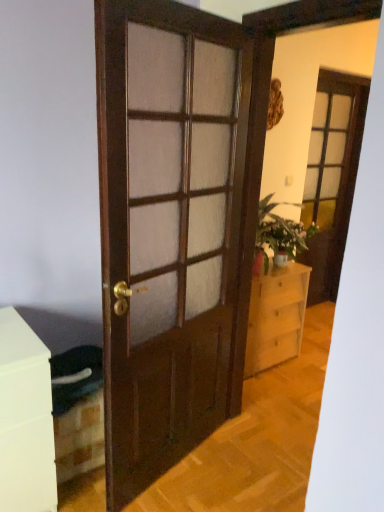
Question: From a real-world perspective, is light wood chest of drawers at center below matte pink vase at center-right?

Choices:
 (A) no
 (B) yes

Answer: (B)

Question: Would you consider light wood chest of drawers at center to be distant from matte pink vase at center-right?

Choices:
 (A) no
 (B) yes

Answer: (A)

Question: From the image's perspective, is light wood chest of drawers at center beneath matte pink vase at center-right?

Choices:
 (A) no
 (B) yes

Answer: (B)

Question: Is light wood chest of drawers at center not within matte pink vase at center-right?

Choices:
 (A) yes
 (B) no

Answer: (A)

Question: Does light wood chest of drawers at center have a smaller size compared to matte pink vase at center-right?

Choices:
 (A) yes
 (B) no

Answer: (B)

Question: In the image, is matte glass screen door at upper right positioned in front of or behind light wood chest of drawers at center?

Choices:
 (A) behind
 (B) front

Answer: (A)

Question: From their relative heights in the image, would you say matte glass screen door at upper right is taller or shorter than light wood chest of drawers at center?

Choices:
 (A) tall
 (B) short

Answer: (A)

Question: Looking at their shapes, would you say matte glass screen door at upper right is wider or thinner than light wood chest of drawers at center?

Choices:
 (A) wide
 (B) thin

Answer: (B)

Question: Considering the positions of point (311, 141) and point (259, 313), is point (311, 141) closer or farther from the camera than point (259, 313)?

Choices:
 (A) farther
 (B) closer

Answer: (A)

Question: Considering their positions, is wooden door at center located in front of or behind light wood chest of drawers at center?

Choices:
 (A) behind
 (B) front

Answer: (B)

Question: Is wooden door at center inside the boundaries of light wood chest of drawers at center, or outside?

Choices:
 (A) outside
 (B) inside

Answer: (A)

Question: From a real-world perspective, is wooden door at center above or below light wood chest of drawers at center?

Choices:
 (A) below
 (B) above

Answer: (B)

Question: Looking at the image, does wooden door at center seem bigger or smaller compared to light wood chest of drawers at center?

Choices:
 (A) big
 (B) small

Answer: (B)

Question: From a real-world perspective, relative to matte pink vase at center-right, is matte glass screen door at upper right vertically above or below?

Choices:
 (A) above
 (B) below

Answer: (A)

Question: From the image's perspective, is matte glass screen door at upper right above or below matte pink vase at center-right?

Choices:
 (A) above
 (B) below

Answer: (A)